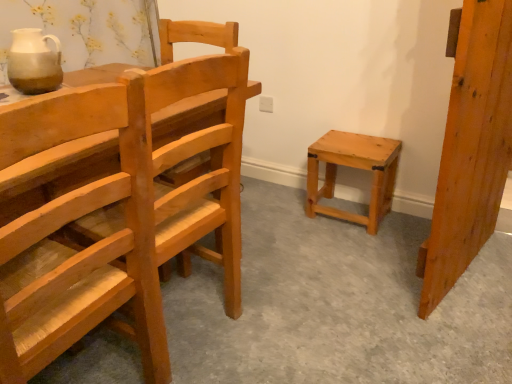
At what (x,y) coordinates should I click in order to perform the action: click on natural wood door at right. Please return your answer as a coordinate pair (x, y). Image resolution: width=512 pixels, height=384 pixels. Looking at the image, I should click on (471, 149).

Locate an element on the screen. natural wood chair at left is located at coordinates [x=77, y=281].

Could you tell me if matte ceramic jug at upper left is turned towards natural wood stool at center-right?

No, matte ceramic jug at upper left is not turned towards natural wood stool at center-right.

From a real-world perspective, is matte ceramic jug at upper left under natural wood stool at center-right?

Incorrect, from a real-world perspective, matte ceramic jug at upper left is higher than natural wood stool at center-right.

Who is smaller, matte ceramic jug at upper left or natural wood stool at center-right?

matte ceramic jug at upper left is smaller.

Is the surface of matte ceramic jug at upper left in direct contact with natural wood stool at center-right?

No, matte ceramic jug at upper left is not in contact with natural wood stool at center-right.

Which is further, (456, 137) or (57, 124)?

The point (456, 137) is farther.

In the scene shown: Considering the positions of objects natural wood door at right and natural wood chair at left in the image provided, who is in front, natural wood door at right or natural wood chair at left?

Positioned in front is natural wood chair at left.

From a real-world perspective, which is physically above, natural wood door at right or natural wood chair at left?

natural wood door at right, from a real-world perspective.

From the image's perspective, which one is positioned lower, natural wood door at right or natural wood chair at left?

natural wood chair at left is shown below in the image.

Between natural wood chair at left and natural wood stool at center-right, which one is positioned behind?

natural wood stool at center-right is more distant.

Is natural wood chair at left smaller than natural wood stool at center-right?

Incorrect, natural wood chair at left is not smaller in size than natural wood stool at center-right.

Which is behind, point (67, 140) or point (385, 149)?

The point (385, 149) is behind.

Does natural wood stool at center-right turn towards matte ceramic jug at upper left?

No, natural wood stool at center-right is not aimed at matte ceramic jug at upper left.

Is natural wood stool at center-right thinner than matte ceramic jug at upper left?

Incorrect, the width of natural wood stool at center-right is not less than that of matte ceramic jug at upper left.

Between natural wood stool at center-right and matte ceramic jug at upper left, which one has larger size?

Bigger between the two is natural wood stool at center-right.

Is point (475, 229) positioned before point (35, 87)?

No, (475, 229) is further to viewer.

Is the depth of natural wood door at right less than that of matte ceramic jug at upper left?

Yes, natural wood door at right is closer to the viewer.

From the image's perspective, is natural wood door at right above matte ceramic jug at upper left?

Actually, natural wood door at right appears below matte ceramic jug at upper left in the image.

Between natural wood chair at left and matte ceramic jug at upper left, which one appears on the right side from the viewer's perspective?

Positioned to the right is natural wood chair at left.

Considering the relative sizes of natural wood chair at left and matte ceramic jug at upper left in the image provided, is natural wood chair at left thinner than matte ceramic jug at upper left?

No.

What are the coordinates of `pottery lying on the left of natural wood chair at left` in the screenshot? It's located at (34, 62).

Can you confirm if natural wood stool at center-right is thinner than natural wood door at right?

No.

Is natural wood stool at center-right far from natural wood door at right?

That's not correct — natural wood stool at center-right is a little close to natural wood door at right.

Considering the relative positions of natural wood stool at center-right and natural wood door at right in the image provided, is natural wood stool at center-right to the right of natural wood door at right from the viewer's perspective?

No.

The width and height of the screenshot is (512, 384). What are the coordinates of `pottery above the natural wood stool at center-right (from a real-world perspective)` in the screenshot? It's located at (34, 62).

Identify the location of chair below the natural wood door at right (from the image's perspective). The width and height of the screenshot is (512, 384). pyautogui.click(x=77, y=281).

Consider the image. From the image, which object appears to be farther from natural wood stool at center-right, natural wood chair at left or matte ceramic jug at upper left?

matte ceramic jug at upper left is further to natural wood stool at center-right.

When comparing their distances from matte ceramic jug at upper left, does natural wood chair at left or natural wood stool at center-right seem further?

natural wood stool at center-right is further to matte ceramic jug at upper left.

Which object lies further to the anchor point natural wood stool at center-right, natural wood door at right or matte ceramic jug at upper left?

matte ceramic jug at upper left.

Based on the photo, which object lies further to the anchor point natural wood door at right, matte ceramic jug at upper left or natural wood stool at center-right?

matte ceramic jug at upper left is positioned further to the anchor natural wood door at right.

From the image, which object appears to be farther from matte ceramic jug at upper left, natural wood door at right or natural wood chair at left?

Based on the image, natural wood door at right appears to be further to matte ceramic jug at upper left.

From the image, which object appears to be farther from natural wood chair at left, natural wood stool at center-right or natural wood door at right?

natural wood stool at center-right is positioned further to the anchor natural wood chair at left.

Considering their positions, is matte ceramic jug at upper left positioned further to natural wood stool at center-right than natural wood chair at left?

The object further to natural wood stool at center-right is matte ceramic jug at upper left.

Which object lies nearer to the anchor point natural wood chair at left, matte ceramic jug at upper left or natural wood door at right?

matte ceramic jug at upper left is closer to natural wood chair at left.

The height and width of the screenshot is (384, 512). I want to click on chair located between matte ceramic jug at upper left and natural wood door at right in the left-right direction, so click(77, 281).

The image size is (512, 384). Identify the location of stool situated between natural wood chair at left and natural wood door at right from left to right. (356, 168).

Locate an element on the screen. stool between matte ceramic jug at upper left and natural wood door at right in the horizontal direction is located at coordinates (356, 168).

Locate an element on the screen. pottery between natural wood chair at left and natural wood stool at center-right in the front-back direction is located at coordinates (34, 62).